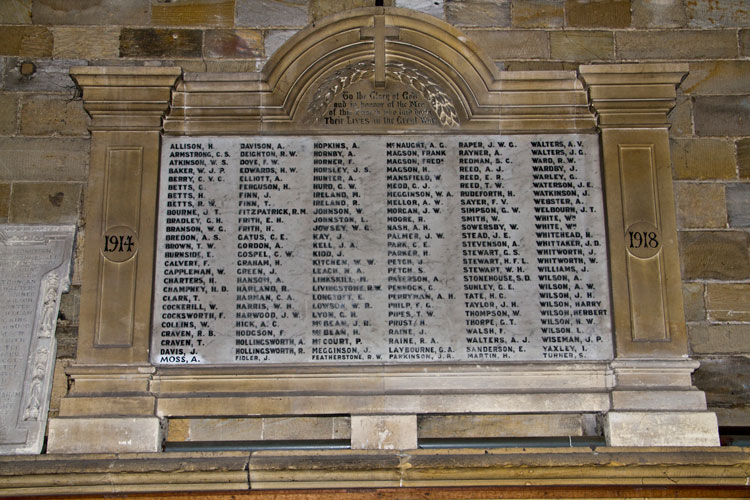
Locate an element on the screen. column is located at coordinates (129, 167), (628, 205).